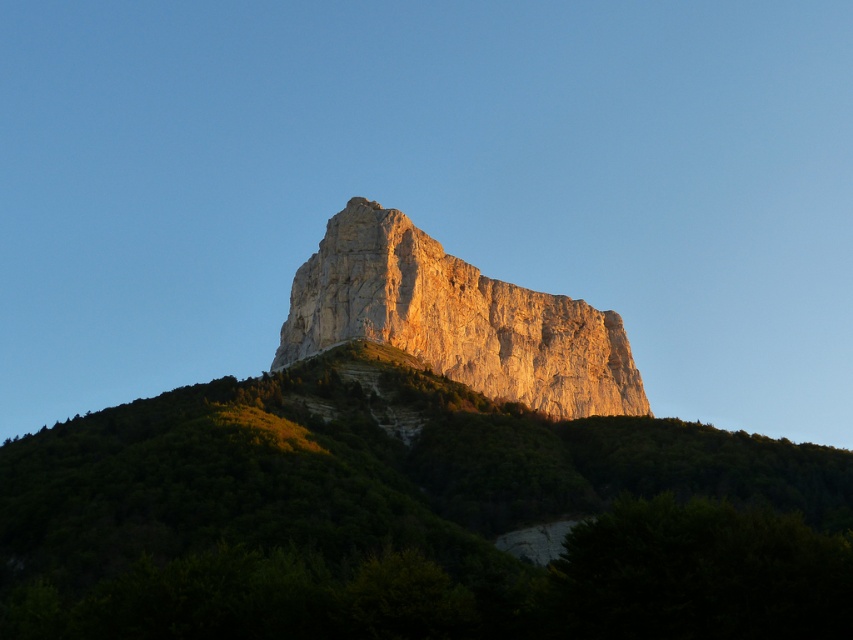
You are a hiker planning to climb the green textured hillside at center and the smooth beige rock at center. Which of these two landmarks is shorter in height?

The green textured hillside at center is not as tall as the smooth beige rock at center, so the green textured hillside at center is shorter in height.

You are a drone operator trying to map the landscape. The drone is currently at the center of the image. You need to fly to the green textured hillside at center. Which direction should you move the drone to reach it?

The green textured hillside at center is already at the center of the image, so you don not need to move the drone in any direction.

Consider the image. You are a hiker planning to climb the smooth beige rock at center. From your current position at the bottom of the green textured hillside at center, which direction should you look to see the rock?

You should look upward because the green textured hillside at center is positioned under the smooth beige rock at center, meaning the rock is above the hillside.